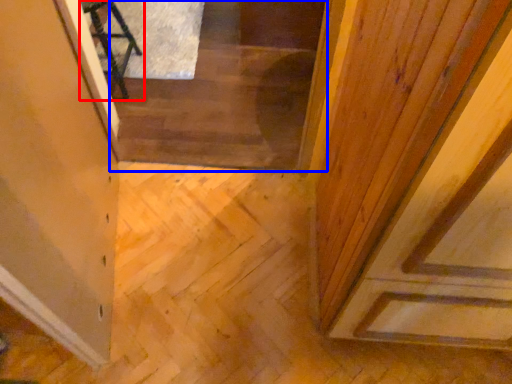
Question: Among these objects, which one is nearest to the camera, furniture (highlighted by a red box) or stairwell (highlighted by a blue box)?

Choices:
 (A) furniture
 (B) stairwell

Answer: (A)